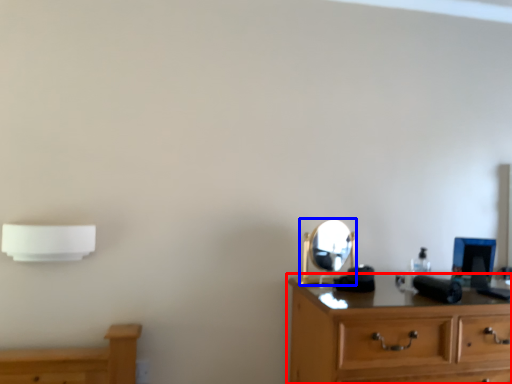
Question: Which point is closer to the camera, chest of drawers (highlighted by a red box) or mirror (highlighted by a blue box)?

Choices:
 (A) chest of drawers
 (B) mirror

Answer: (A)